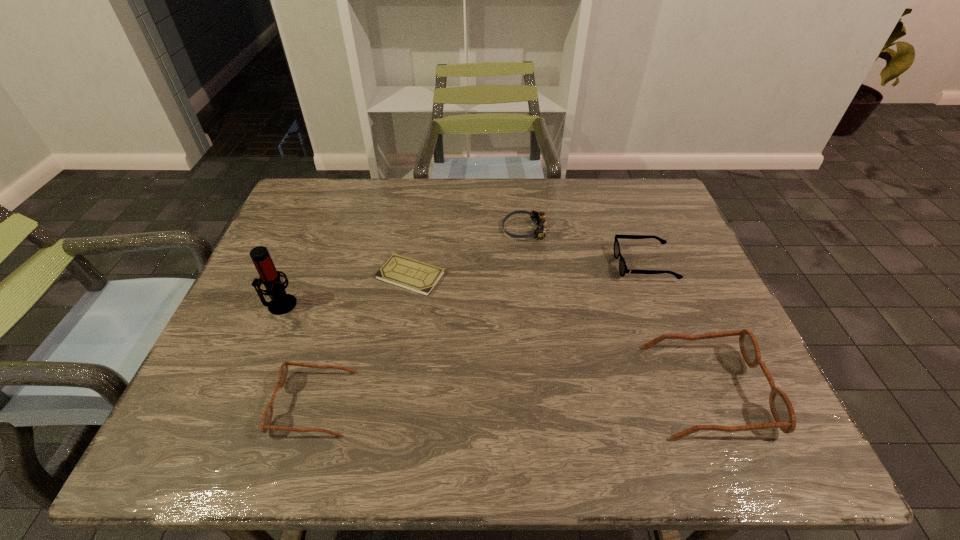
Where is `the leftmost spectacles`? Image resolution: width=960 pixels, height=540 pixels. the leftmost spectacles is located at coordinates (268, 412).

Find the location of `the tallest spectacles`. the tallest spectacles is located at coordinates (782, 410).

Locate an element on the screen. goggles is located at coordinates (538, 217).

You are a GUI agent. You are given a task and a screenshot of the screen. Output one action in this format:
    pyautogui.click(x=<x>, y=<y>)
    Task: Click on the third object from right to left
    The width and height of the screenshot is (960, 540).
    Given the screenshot: What is the action you would take?
    pyautogui.click(x=538, y=217)

Locate an element on the screen. The image size is (960, 540). the shortest spectacles is located at coordinates (623, 269).

You are a GUI agent. You are given a task and a screenshot of the screen. Output one action in this format:
    pyautogui.click(x=<x>, y=<y>)
    Task: Click on the leftmost object
    
    Given the screenshot: What is the action you would take?
    pyautogui.click(x=281, y=303)

This screenshot has width=960, height=540. Identify the location of the tallest object. (281, 303).

You are a GUI agent. You are given a task and a screenshot of the screen. Output one action in this format:
    pyautogui.click(x=<x>, y=<y>)
    Task: Click on the checkbook
    
    Given the screenshot: What is the action you would take?
    pyautogui.click(x=414, y=275)

Where is `vacant space located on the front-facing side of the leftmost spectacles`? This screenshot has width=960, height=540. vacant space located on the front-facing side of the leftmost spectacles is located at coordinates (193, 403).

The image size is (960, 540). What are the coordinates of `vacant space located on the front-facing side of the leftmost spectacles` in the screenshot? It's located at click(242, 403).